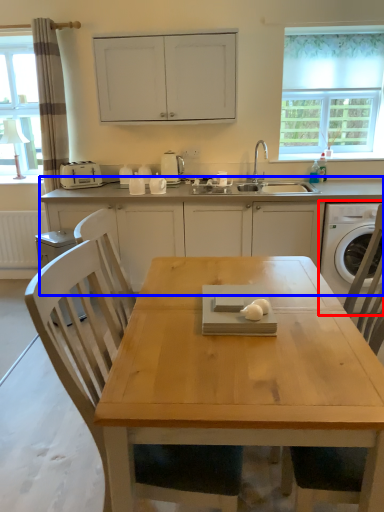
Question: Which of the following is the closest to the observer, washing machine (highlighted by a red box) or cabinetry (highlighted by a blue box)?

Choices:
 (A) washing machine
 (B) cabinetry

Answer: (A)